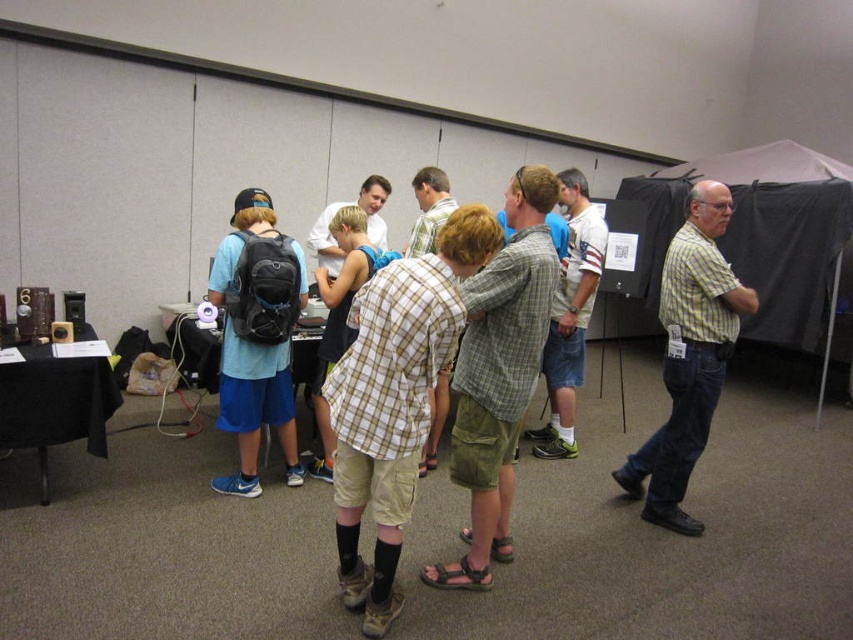
Question: Which of these objects is positioned closest to the green plaid shirt at center?

Choices:
 (A) plaid cotton shirt at center
 (B) light blue t-shirt at left
 (C) light gray plaid shirt at center

Answer: (A)

Question: Which object appears closest to the camera in this image?

Choices:
 (A) green plaid shirt at center
 (B) light blue t-shirt at left

Answer: (A)

Question: In this image, where is plaid cotton shirt at center located relative to green plaid shirt at center?

Choices:
 (A) right
 (B) left

Answer: (B)

Question: Among these objects, which one is farthest from the camera?

Choices:
 (A) yellow-green plaid shirt at right
 (B) plaid cotton shirt at center
 (C) light blue t-shirt at left

Answer: (C)

Question: Is green plaid shirt at center thinner than light blue t-shirt at left?

Choices:
 (A) yes
 (B) no

Answer: (B)

Question: Is yellow-green plaid shirt at right positioned in front of light blue t-shirt at left?

Choices:
 (A) yes
 (B) no

Answer: (A)